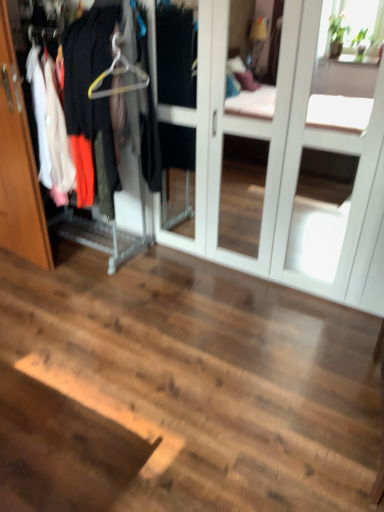
At what (x,y) coordinates should I click in order to perform the action: click on free spot in front of wooden door at left. Please return your answer as a coordinate pair (x, y). The image size is (384, 512). Looking at the image, I should click on (27, 288).